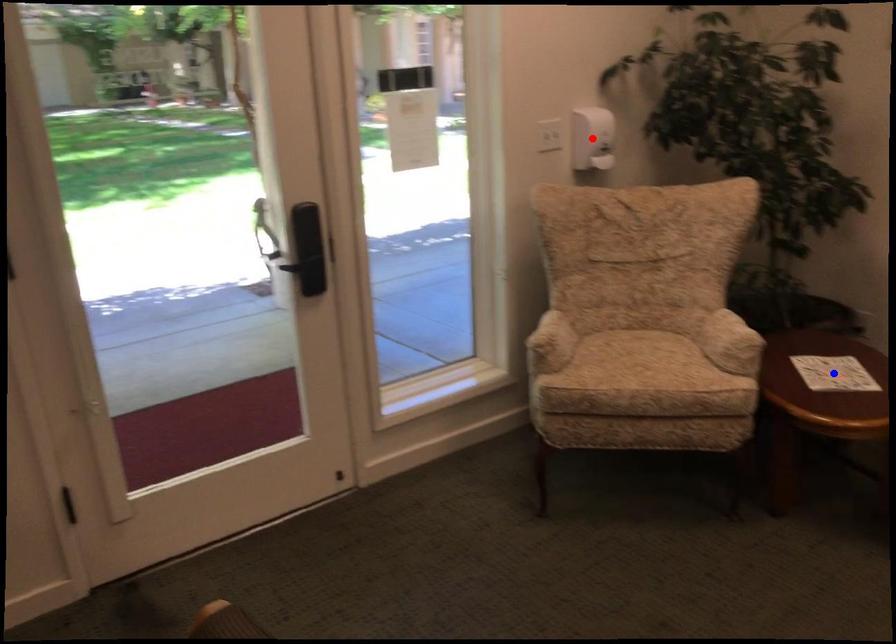
Question: Which of the two points in the image is closer to the camera?

Choices:
 (A) Blue point is closer.
 (B) Red point is closer.

Answer: (A)